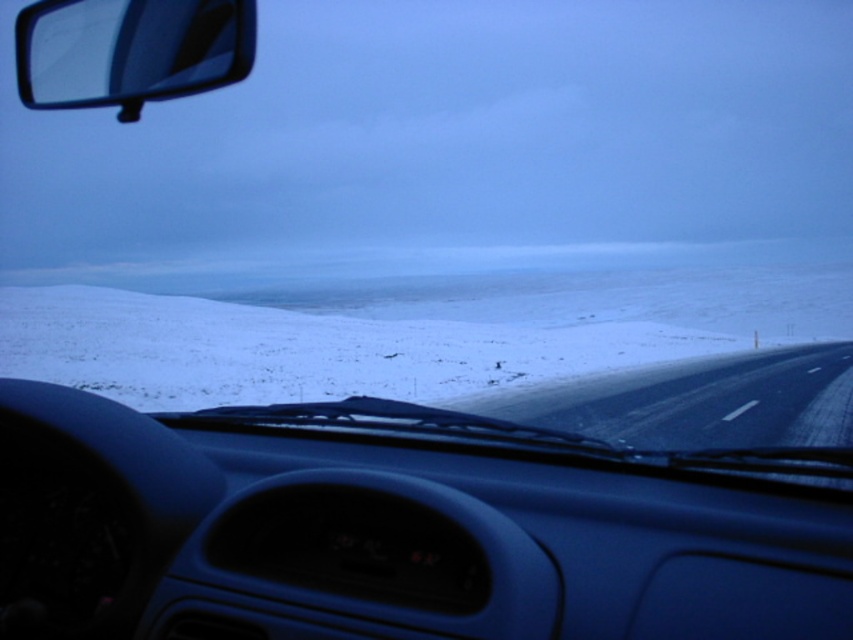
You are driving a car and notice the transparent glass side mirror at upper left. Can you see the white powdery snow at center through it?

Yes, the white powdery snow at center is positioned under the transparent glass side mirror at upper left, so it should be visible through the mirror.